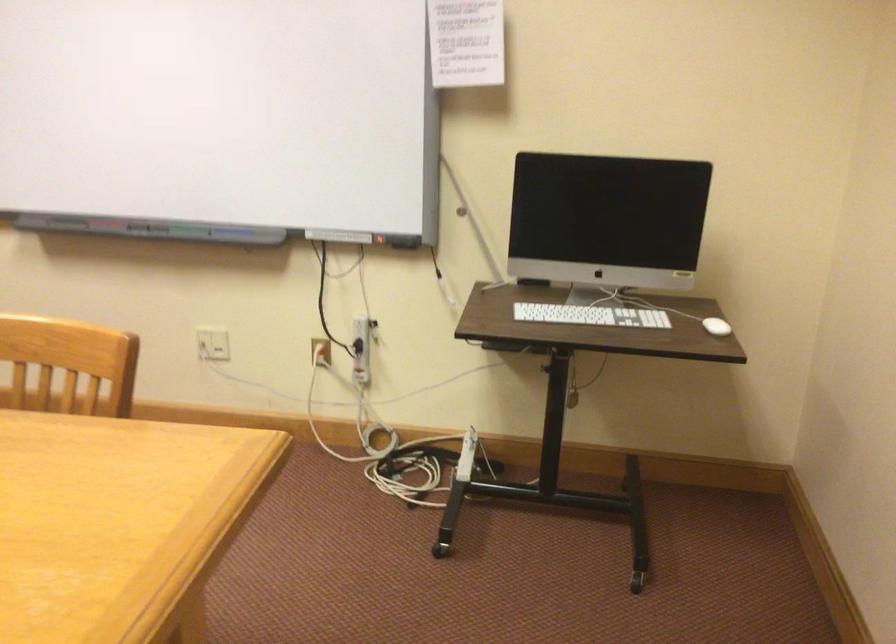
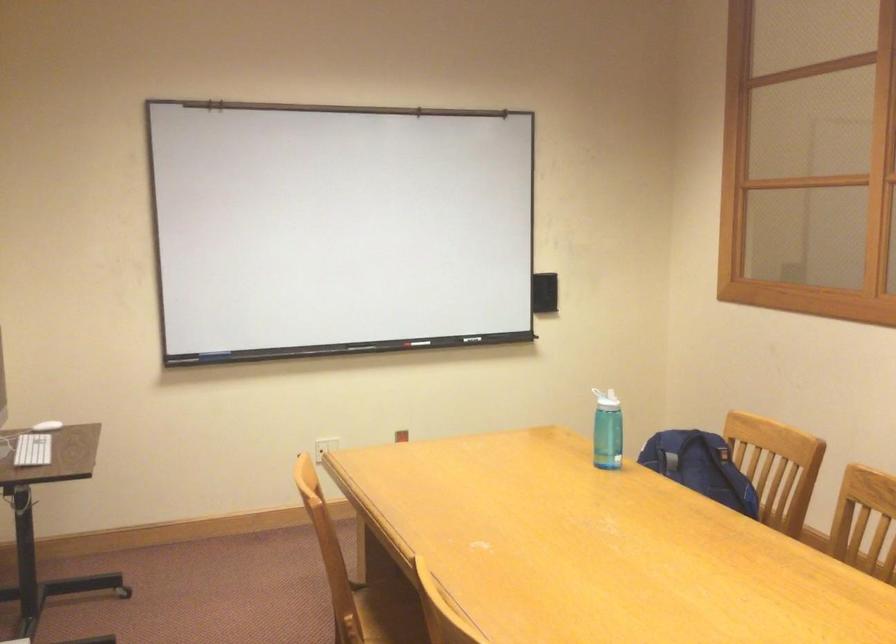
Find the pixel in the second image that matches the point at 702,325 in the first image.

(47, 426)